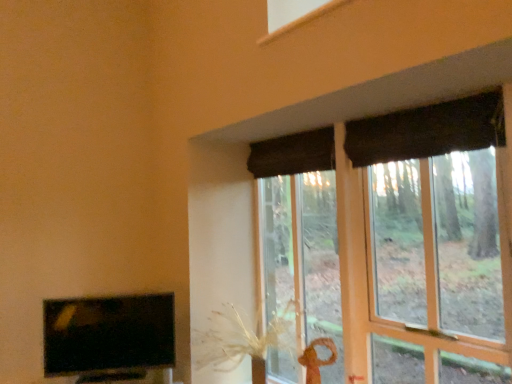
Question: Is matte black tv at lower left surrounded by matte brown curtain at upper right?

Choices:
 (A) no
 (B) yes

Answer: (A)

Question: From a real-world perspective, is matte brown curtain at upper right physically above matte black tv at lower left?

Choices:
 (A) yes
 (B) no

Answer: (A)

Question: Does matte brown curtain at upper right have a greater height compared to matte black tv at lower left?

Choices:
 (A) no
 (B) yes

Answer: (B)

Question: Does matte brown curtain at upper right have a greater width compared to matte black tv at lower left?

Choices:
 (A) yes
 (B) no

Answer: (A)

Question: Are matte brown curtain at upper right and matte black tv at lower left making contact?

Choices:
 (A) no
 (B) yes

Answer: (A)

Question: Is matte brown curtain at upper right thinner than matte black tv at lower left?

Choices:
 (A) yes
 (B) no

Answer: (B)

Question: From a real-world perspective, is dark fabric curtain at upper right, marked as the second curtain in a left-to-right arrangement, over matte brown curtain at upper right?

Choices:
 (A) yes
 (B) no

Answer: (A)

Question: Is dark fabric curtain at upper right, marked as the second curtain in a left-to-right arrangement, wider than matte brown curtain at upper right?

Choices:
 (A) no
 (B) yes

Answer: (A)

Question: From the image's perspective, is dark fabric curtain at upper right, the first curtain viewed from the front, on top of matte brown curtain at upper right?

Choices:
 (A) yes
 (B) no

Answer: (A)

Question: From a real-world perspective, is dark fabric curtain at upper right, marked as the second curtain in a left-to-right arrangement, below matte brown curtain at upper right?

Choices:
 (A) yes
 (B) no

Answer: (B)

Question: Is matte brown curtain at upper right surrounded by dark fabric curtain at upper right, placed as the 2th curtain when sorted from back to front?

Choices:
 (A) yes
 (B) no

Answer: (B)

Question: Is dark fabric curtain at upper right, acting as the 1th curtain starting from the right, outside matte brown curtain at upper right?

Choices:
 (A) yes
 (B) no

Answer: (B)

Question: Is matte black tv at lower left bigger than dark fabric curtain at upper center, the first curtain in the left-to-right sequence?

Choices:
 (A) no
 (B) yes

Answer: (B)